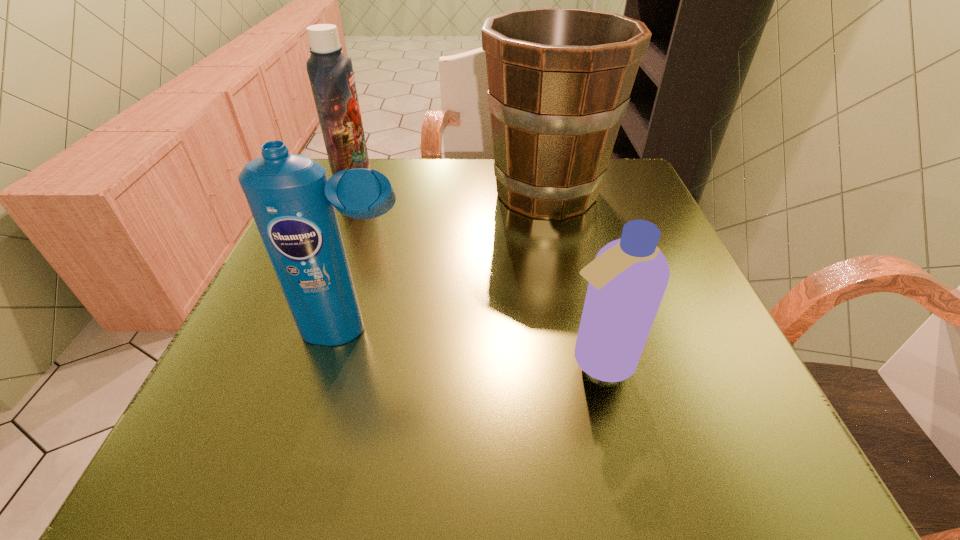
In order to click on unoccupied position between the farthest shampoo and the rightmost shampoo in this screenshot , I will do coord(476,274).

Identify the location of blank region between the bucket and the shortest shampoo. (572, 275).

Identify which object is the closest to the farthest shampoo. Please provide its 2D coordinates. Your answer should be formatted as a tuple, i.e. [(x, y)], where the tuple contains the x and y coordinates of a point satisfying the conditions above.

[(559, 79)]

Identify the location of object that is the third nearest to the shortest object. This screenshot has height=540, width=960. (330, 72).

Locate an element on the screen. the second closest shampoo relative to the farthest shampoo is located at coordinates (627, 280).

Locate an element on the screen. The image size is (960, 540). shampoo identified as the closest to the farthest shampoo is located at coordinates [293, 203].

I want to click on free point that satisfies the following two spatial constraints: 1. on the back side of the bucket; 2. on the front label of the farthest shampoo, so click(x=545, y=188).